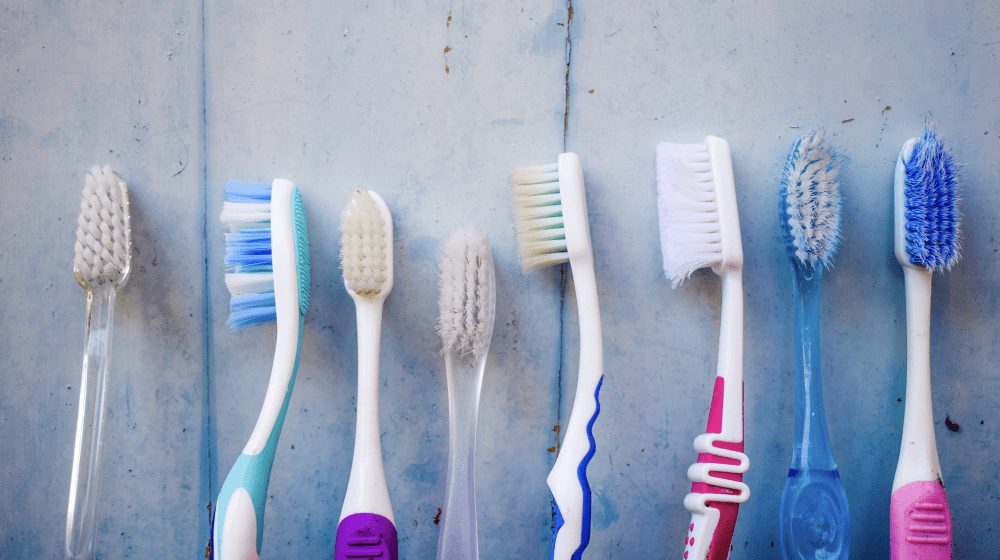
Image resolution: width=1000 pixels, height=560 pixels. What are the coordinates of `pink brush handle` in the screenshot? It's located at (933, 546).